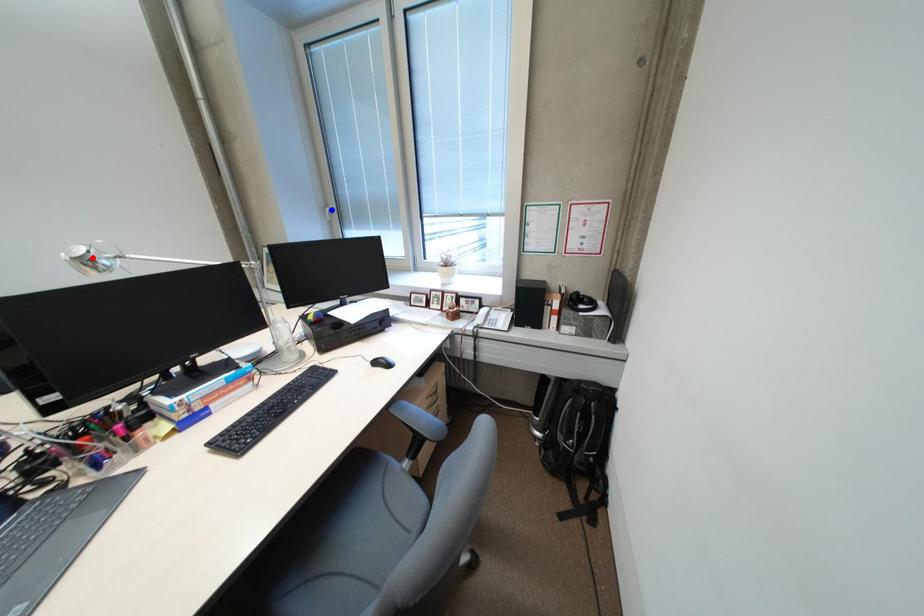
Question: Which of the two points in the image is closer to the camera?

Choices:
 (A) Blue point is closer.
 (B) Red point is closer.

Answer: (B)